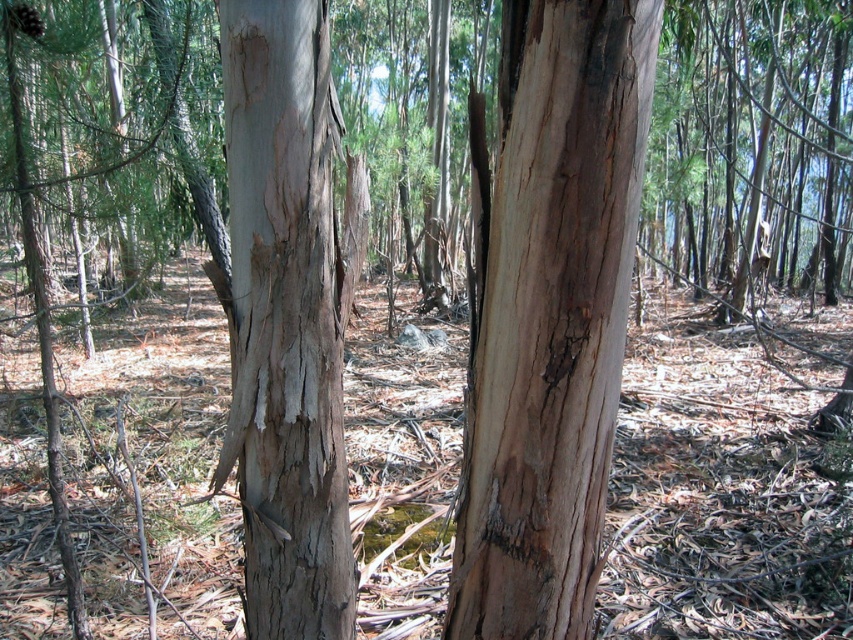
Question: Which point is farther to the camera?

Choices:
 (A) light brown bark at center
 (B) light brown rough bark at center

Answer: (B)

Question: Is light brown bark at center bigger than light brown rough bark at center?

Choices:
 (A) no
 (B) yes

Answer: (A)

Question: Considering the relative positions of light brown bark at center and light brown rough bark at center in the image provided, where is light brown bark at center located with respect to light brown rough bark at center?

Choices:
 (A) right
 (B) left

Answer: (A)

Question: Is light brown bark at center above light brown rough bark at center?

Choices:
 (A) yes
 (B) no

Answer: (B)

Question: Which object appears farthest from the camera in this image?

Choices:
 (A) light brown bark at center
 (B) light brown rough bark at center

Answer: (B)